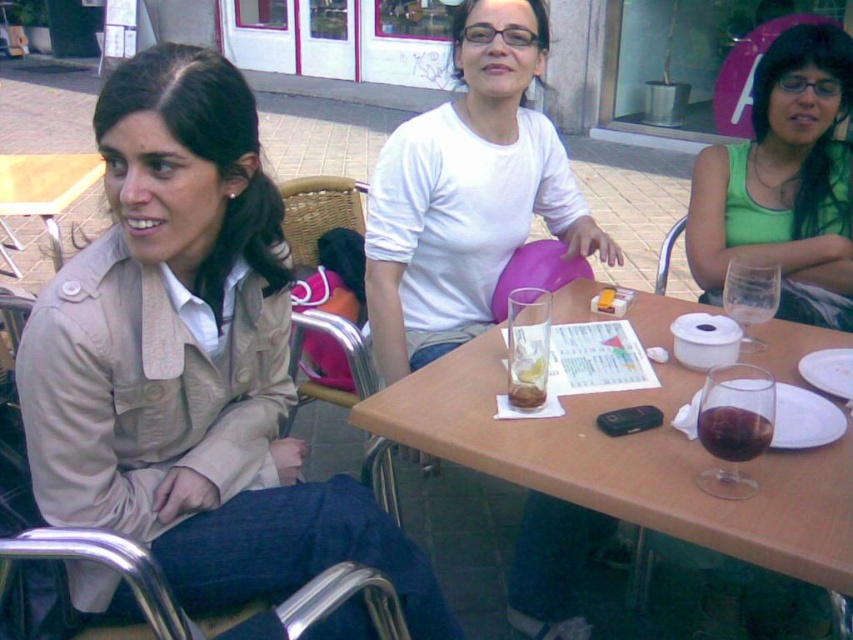
Question: Among these objects, which one is nearest to the camera?

Choices:
 (A) beige fabric jacket at left
 (B) green matte tank top at upper right
 (C) wooden table at center

Answer: (C)

Question: Considering the real-world distances, which object is closest to the dark red liquid at table center?

Choices:
 (A) beige fabric jacket at left
 (B) green matte tank top at upper right

Answer: (A)

Question: Is green matte tank top at upper right smaller than smooth brown bread at center?

Choices:
 (A) yes
 (B) no

Answer: (B)

Question: Does white matte shirt at center have a greater width compared to dark red liquid at table center?

Choices:
 (A) yes
 (B) no

Answer: (A)

Question: Among these points, which one is farthest from the camera?

Choices:
 (A) (59, 250)
 (B) (381, 269)
 (C) (759, 440)
 (D) (529, 406)

Answer: (A)

Question: Does beige fabric jacket at left have a larger size compared to wooden table at center?

Choices:
 (A) no
 (B) yes

Answer: (A)